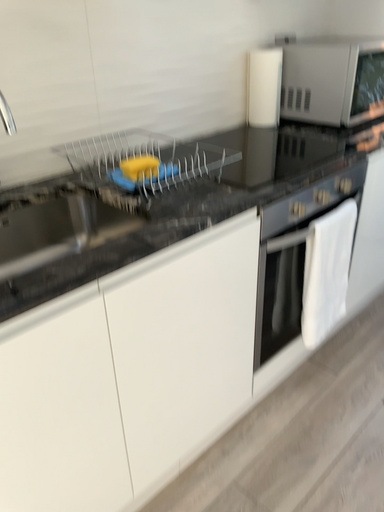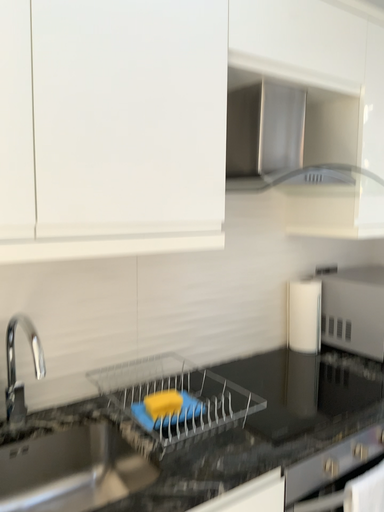
Question: Which way did the camera rotate in the video?

Choices:
 (A) rotated upward
 (B) rotated downward

Answer: (A)